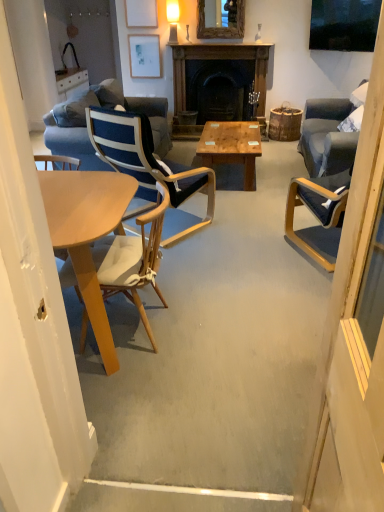
Find the location of a particular element. natural wood chair at left, the second chair viewed from the back is located at coordinates pyautogui.click(x=133, y=259).

Describe the element at coordinates (231, 147) in the screenshot. The width and height of the screenshot is (384, 512). I see `woodenmaterial/texturecoffee table at center` at that location.

I want to click on woodenmaterial/texturecoffee table at center, so click(x=231, y=147).

The height and width of the screenshot is (512, 384). Find the location of `matte white lampshade at upper center`. matte white lampshade at upper center is located at coordinates (173, 18).

Describe the element at coordinates (105, 108) in the screenshot. I see `blue fabric couch at center` at that location.

I want to click on natural wood chair at left, the second chair viewed from the back, so click(x=133, y=259).

Which is in front, blue fabric chair at center, the first chair viewed from the back, or natural wood chair at left, the second chair viewed from the back?

natural wood chair at left, the second chair viewed from the back.

Is point (167, 241) positioned before point (149, 212)?

No, (167, 241) is further to viewer.

This screenshot has width=384, height=512. I want to click on chair behind the natural wood chair at left, the second chair viewed from the back, so click(x=150, y=168).

Is woodenmaterial/texturecoffee table at center touching wooden frame mirror at upper center?

No, woodenmaterial/texturecoffee table at center is not next to wooden frame mirror at upper center.

At what (x,y) coordinates should I click in order to perform the action: click on mirror located above the woodenmaterial/texturecoffee table at center (from a real-world perspective). Please return your answer as a coordinate pair (x, y). This screenshot has width=384, height=512. Looking at the image, I should click on (220, 21).

How different are the orientations of woodenmaterial/texturecoffee table at center and wooden frame mirror at upper center in degrees?

They differ by 90 degrees in their facing directions.

Does woodenmaterial/texturecoffee table at center have a lesser width compared to wooden frame mirror at upper center?

No, woodenmaterial/texturecoffee table at center is not thinner than wooden frame mirror at upper center.

Is matte blue chair at right oriented towards wooden frame mirror at upper center?

No, matte blue chair at right is not aimed at wooden frame mirror at upper center.

Which of these two, matte blue chair at right or wooden frame mirror at upper center, is thinner?

With smaller width is matte blue chair at right.

From the image's perspective, is matte blue chair at right positioned above or below wooden frame mirror at upper center?

From the image's perspective, matte blue chair at right appears below wooden frame mirror at upper center.

Can you confirm if matte white lampshade at upper center is thinner than natural wood chair at left, which is the 1th chair from front to back?

Yes, matte white lampshade at upper center is thinner than natural wood chair at left, which is the 1th chair from front to back.

From a real-world perspective, between matte white lampshade at upper center and natural wood chair at left, which is the 1th chair from front to back, who is vertically lower?

natural wood chair at left, which is the 1th chair from front to back, is physically lower.

Is matte white lampshade at upper center not close to natural wood chair at left, which is the 1th chair from front to back?

Yes, matte white lampshade at upper center and natural wood chair at left, which is the 1th chair from front to back, are located far from each other.

Considering the positions of points (171, 14) and (157, 237), is point (171, 14) farther from camera compared to point (157, 237)?

Yes, point (171, 14) is farther from viewer.

Between blue fabric chair at center, the first chair viewed from the back, and blue fabric couch at center, which one has less height?

Standing shorter between the two is blue fabric couch at center.

From a real-world perspective, is blue fabric chair at center, the first chair viewed from the back, below blue fabric couch at center?

Actually, blue fabric chair at center, the first chair viewed from the back, is physically above blue fabric couch at center in the real world.

Considering the positions of objects blue fabric chair at center, placed as the 2th chair when sorted from front to back, and blue fabric couch at center in the image provided, who is more to the right, blue fabric chair at center, placed as the 2th chair when sorted from front to back, or blue fabric couch at center?

From the viewer's perspective, blue fabric chair at center, placed as the 2th chair when sorted from front to back, appears more on the right side.

Is blue fabric chair at center, placed as the 2th chair when sorted from front to back, behind blue fabric couch at center?

No, the depth of blue fabric chair at center, placed as the 2th chair when sorted from front to back, is less than that of blue fabric couch at center.

Find the location of a particular element. studio couch behind the natural wood chair at left, the second chair viewed from the back is located at coordinates (105, 108).

From the picture: Does natural wood chair at left, the second chair viewed from the back, have a greater width compared to blue fabric couch at center?

No.

Does point (109, 238) come behind point (61, 137)?

No, (109, 238) is closer to viewer.

Can you confirm if natural wood chair at left, the second chair viewed from the back, is smaller than blue fabric couch at center?

Indeed, natural wood chair at left, the second chair viewed from the back, has a smaller size compared to blue fabric couch at center.

Is blue fabric couch at center not near matte white lampshade at upper center?

Yes, blue fabric couch at center and matte white lampshade at upper center are located far from each other.

Locate an element on the screen. The width and height of the screenshot is (384, 512). lamp above the blue fabric couch at center (from the image's perspective) is located at coordinates (173, 18).

Which is behind, blue fabric couch at center or matte white lampshade at upper center?

matte white lampshade at upper center is further away from the camera.

Image resolution: width=384 pixels, height=512 pixels. I want to click on chair that is in front of the blue fabric chair at center, placed as the 2th chair when sorted from front to back, so click(133, 259).

In order to click on mirror on the left of woodenmaterial/texturecoffee table at center in this screenshot , I will do `click(220, 21)`.

In the scene shown: When comparing their distances from wooden frame mirror at upper center, does matte white picture frame at upper center, the 1th picture frame positioned from the back, or matte white lampshade at upper center seem closer?

matte white lampshade at upper center is closer to wooden frame mirror at upper center.

Looking at the image, which one is located further to wooden fireplace at center, natural wood chair at left, which is the 1th chair from front to back, or matte blue chair at right?

matte blue chair at right.

In the scene shown: From the image, which object appears to be nearer to matte white lampshade at upper center, woodenmaterial/texturecoffee table at center or wooden frame mirror at upper center?

wooden frame mirror at upper center lies closer to matte white lampshade at upper center than the other object.

From the image, which object appears to be farther from wooden fireplace at center, wooden frame mirror at upper center or matte white picture frame at upper center, which ranks as the 1th picture frame in bottom-to-top order?

Based on the image, matte white picture frame at upper center, which ranks as the 1th picture frame in bottom-to-top order, appears to be further to wooden fireplace at center.

Considering their positions, is matte white picture frame at upper center, the second picture frame positioned from the top, positioned closer to matte blue chair at right than natural wood chair at left, the second chair viewed from the back?

natural wood chair at left, the second chair viewed from the back, is positioned closer to the anchor matte blue chair at right.

Estimate the real-world distances between objects in this image. Which object is closer to matte white picture frame at upper center, the second picture frame positioned from the top, natural wood chair at left, the second chair viewed from the back, or matte white picture frame at upper center, arranged as the 2th picture frame when ordered from the bottom?

matte white picture frame at upper center, arranged as the 2th picture frame when ordered from the bottom, lies closer to matte white picture frame at upper center, the second picture frame positioned from the top, than the other object.

Based on their spatial positions, is wooden fireplace at center or matte blue chair at right further from woodenmaterial/texturecoffee table at center?

Among the two, matte blue chair at right is located further to woodenmaterial/texturecoffee table at center.

Estimate the real-world distances between objects in this image. Which object is closer to blue fabric chair at center, the first chair viewed from the back, woodenmaterial/texturecoffee table at center or natural wood chair at left, which is the 1th chair from front to back?

Based on the image, natural wood chair at left, which is the 1th chair from front to back, appears to be nearer to blue fabric chair at center, the first chair viewed from the back.

Where is `coffee table between blue fabric chair at center, placed as the 2th chair when sorted from front to back, and wooden fireplace at center, along the z-axis`? Image resolution: width=384 pixels, height=512 pixels. coffee table between blue fabric chair at center, placed as the 2th chair when sorted from front to back, and wooden fireplace at center, along the z-axis is located at coordinates (231, 147).

At what (x,y) coordinates should I click in order to perform the action: click on mirror between natural wood chair at left, which is the 1th chair from front to back, and matte white picture frame at upper center, arranged as the 2th picture frame when ordered from the bottom, from front to back. Please return your answer as a coordinate pair (x, y). The height and width of the screenshot is (512, 384). Looking at the image, I should click on (220, 21).

Locate an element on the screen. picture frame between blue fabric couch at center and matte white picture frame at upper center, the second picture frame positioned from the front, from front to back is located at coordinates (141, 13).

Locate an element on the screen. Image resolution: width=384 pixels, height=512 pixels. studio couch between matte blue chair at right and woodenmaterial/texturecoffee table at center in the front-back direction is located at coordinates (105, 108).